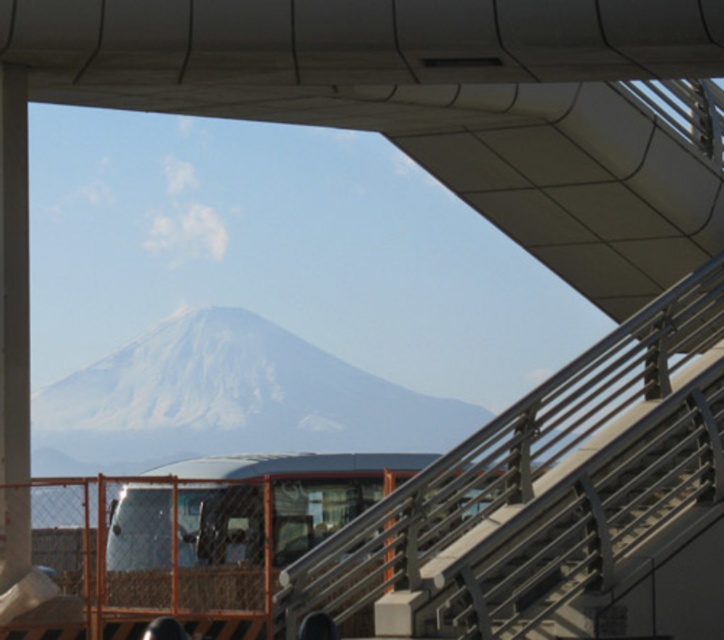
Does white snow-covered mountain at center have a larger size compared to white glossy pillar at left?

Correct, white snow-covered mountain at center is larger in size than white glossy pillar at left.

Describe the element at coordinates (227, 401) in the screenshot. I see `white snow-covered mountain at center` at that location.

Locate an element on the screen. This screenshot has height=640, width=724. white snow-covered mountain at center is located at coordinates (227, 401).